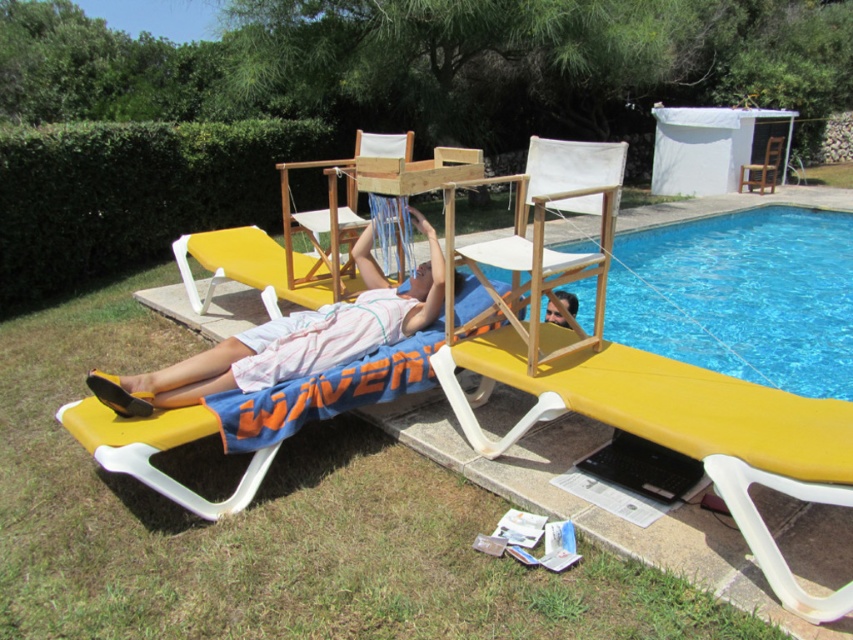
What is the spatial relationship between the yellow plastic daybed at lower left and the yellow plastic beach chair at center?

The yellow plastic daybed at lower left is positioned to the right of the yellow plastic beach chair at center.

You are a guest at this poolside area and want to find the matte pink towel at lower left. Where would you look relative to the yellow plastic beach chair at center?

The matte pink towel at lower left is positioned under the yellow plastic beach chair at center, so it is located beneath the chair.